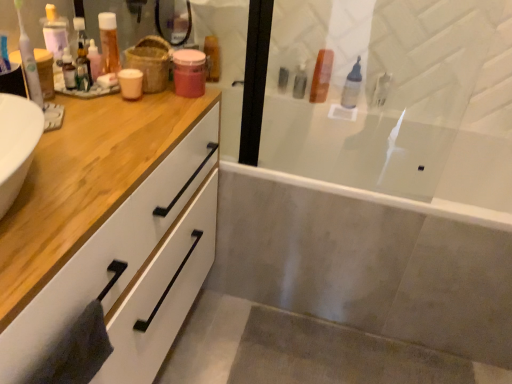
The width and height of the screenshot is (512, 384). What do you see at coordinates (352, 86) in the screenshot?
I see `clear plastic bottle at upper right, the third toiletry positioned from the front` at bounding box center [352, 86].

Identify the location of translucent plastic bottle at upper center, the fourth toiletry viewed from the left. (321, 76).

Describe the element at coordinates (398, 98) in the screenshot. I see `transparent glass screen door at upper center` at that location.

This screenshot has width=512, height=384. What do you see at coordinates (109, 42) in the screenshot? I see `translucent plastic bottle at upper left, acting as the 2th toiletry starting from the left` at bounding box center [109, 42].

Find the location of a particular element. clear plastic bottle at upper right, which is the fifth toiletry in left-to-right order is located at coordinates (352, 86).

Image resolution: width=512 pixels, height=384 pixels. Find the location of `toiletry that is the 3rd object to the left of the transparent glass screen door at upper center, starting at the anchor`. toiletry that is the 3rd object to the left of the transparent glass screen door at upper center, starting at the anchor is located at coordinates (83, 69).

Looking at this image, does transparent glass screen door at upper center have a greater height compared to translucent plastic bottles at upper left, positioned as the fifth toiletry in back-to-front order?

Yes, transparent glass screen door at upper center is taller than translucent plastic bottles at upper left, positioned as the fifth toiletry in back-to-front order.

Is transparent glass screen door at upper center positioned with its back to translucent plastic bottles at upper left, which appears as the first toiletry when viewed from the front?

Yes, translucent plastic bottles at upper left, which appears as the first toiletry when viewed from the front, is at the back of transparent glass screen door at upper center.

Which object is wider, transparent glass screen door at upper center or translucent plastic bottles at upper left, positioned as the fifth toiletry in back-to-front order?

translucent plastic bottles at upper left, positioned as the fifth toiletry in back-to-front order.

From the image's perspective, is translucent plastic bottle at upper center, which is the 2th toiletry in back-to-front order, on top of translucent plastic bottles at upper left, positioned as the fifth toiletry in back-to-front order?

Yes, from the image's perspective, translucent plastic bottle at upper center, which is the 2th toiletry in back-to-front order, is above translucent plastic bottles at upper left, positioned as the fifth toiletry in back-to-front order.

What are the coordinates of `the 3rd toiletry to the left of the translucent plastic bottle at upper center, the 2th toiletry from the right, starting your count from the anchor` in the screenshot? It's located at (83, 69).

Is translucent plastic bottles at upper left, positioned as the fifth toiletry in back-to-front order, inside translucent plastic bottle at upper center, the fourth toiletry viewed from the left?

No, translucent plastic bottles at upper left, positioned as the fifth toiletry in back-to-front order, is located outside of translucent plastic bottle at upper center, the fourth toiletry viewed from the left.

From the image's perspective, would you say translucent plastic bottle at upper left, acting as the 2th toiletry starting from the left, is shown under white plastic toothbrush at left?

No, from the image's perspective, translucent plastic bottle at upper left, acting as the 2th toiletry starting from the left, is not beneath white plastic toothbrush at left.

From the white plastic toothbrush at left, count 2nd toiletry to the right and point to it. Please provide its 2D coordinates.

[(109, 42)]

Which of these two, translucent plastic bottle at upper left, which is counted as the 4th toiletry, starting from the right, or white plastic toothbrush at left, is thinner?

white plastic toothbrush at left is thinner.

From a real-world perspective, is translucent plastic bottle at upper left, which is counted as the 4th toiletry, starting from the right, positioned over white plastic toothbrush at left based on gravity?

No.

Is point (204, 42) farther from camera compared to point (404, 184)?

No.

Locate an element on the screen. toiletry that is the 1st one below the transparent glass screen door at upper center (from a real-world perspective) is located at coordinates (212, 58).

Which of these two, pink matte jar at upper center, which is the first toiletry in back-to-front order, or transparent glass screen door at upper center, is bigger?

transparent glass screen door at upper center.

Considering the sizes of pink matte jar at upper center, placed as the 3th toiletry when sorted from right to left, and transparent glass screen door at upper center in the image, is pink matte jar at upper center, placed as the 3th toiletry when sorted from right to left, wider or thinner than transparent glass screen door at upper center?

pink matte jar at upper center, placed as the 3th toiletry when sorted from right to left, is wider than transparent glass screen door at upper center.

How many degrees apart are the facing directions of pink matte jar at upper center, which is the first toiletry in back-to-front order, and burlap basket at upper center?

There is a 85.5-degree angle between the facing directions of pink matte jar at upper center, which is the first toiletry in back-to-front order, and burlap basket at upper center.

From a real-world perspective, is pink matte jar at upper center, which is the first toiletry in back-to-front order, physically located above or below burlap basket at upper center?

pink matte jar at upper center, which is the first toiletry in back-to-front order, is below burlap basket at upper center.

In terms of size, does pink matte jar at upper center, the third toiletry from the left, appear bigger or smaller than burlap basket at upper center?

Clearly, pink matte jar at upper center, the third toiletry from the left, is smaller in size than burlap basket at upper center.

Between point (219, 65) and point (146, 50), which one is positioned behind?

The point (219, 65) is more distant.

Do you think translucent plastic bottle at upper center, the fourth toiletry viewed from the left, is within transparent glass screen door at upper center, or outside of it?

translucent plastic bottle at upper center, the fourth toiletry viewed from the left, is not enclosed by transparent glass screen door at upper center.

I want to click on screen door located above the translucent plastic bottle at upper center, the 2th toiletry from the right (from a real-world perspective), so click(x=398, y=98).

Between translucent plastic bottle at upper center, marked as the fourth toiletry in a front-to-back arrangement, and transparent glass screen door at upper center, which one has more height?

Standing taller between the two is transparent glass screen door at upper center.

Which is in front, translucent plastic bottle at upper center, marked as the fourth toiletry in a front-to-back arrangement, or transparent glass screen door at upper center?

Positioned in front is transparent glass screen door at upper center.

Is transparent glass screen door at upper center facing towards translucent plastic bottle at upper left, which is counted as the 4th toiletry, starting from the right?

Yes, transparent glass screen door at upper center is turned towards translucent plastic bottle at upper left, which is counted as the 4th toiletry, starting from the right.

Is transparent glass screen door at upper center beside translucent plastic bottle at upper left, which is the second toiletry from front to back?

transparent glass screen door at upper center and translucent plastic bottle at upper left, which is the second toiletry from front to back, are not in contact.

Does transparent glass screen door at upper center have a smaller size compared to translucent plastic bottle at upper left, which is the second toiletry from front to back?

Incorrect, transparent glass screen door at upper center is not smaller in size than translucent plastic bottle at upper left, which is the second toiletry from front to back.

Looking at this image, can you confirm if transparent glass screen door at upper center is shorter than translucent plastic bottle at upper left, acting as the 2th toiletry starting from the left?

In fact, transparent glass screen door at upper center may be taller than translucent plastic bottle at upper left, acting as the 2th toiletry starting from the left.

The width and height of the screenshot is (512, 384). Find the location of `toiletry that is the 1st object located behind the transparent glass screen door at upper center`. toiletry that is the 1st object located behind the transparent glass screen door at upper center is located at coordinates (83, 69).

Locate an element on the screen. This screenshot has width=512, height=384. the 3rd toiletry in front of the translucent plastic bottle at upper center, the 2th toiletry from the right, starting your count from the anchor is located at coordinates click(83, 69).

Considering their positions, is translucent plastic bottles at upper left, which appears as the 5th toiletry when viewed from the right, positioned closer to white plastic toothbrush at left than pink matte jar at upper center, placed as the 5th toiletry when sorted from front to back?

translucent plastic bottles at upper left, which appears as the 5th toiletry when viewed from the right.

Considering their positions, is transparent glass screen door at upper center positioned closer to white glossy bathtub at center than translucent plastic bottle at upper center, the fourth toiletry viewed from the left?

transparent glass screen door at upper center.

Based on their spatial positions, is clear plastic bottle at upper right, the third toiletry positioned from the front, or pink matte jar at upper center, placed as the 3th toiletry when sorted from right to left, closer to white plastic toothbrush at left?

pink matte jar at upper center, placed as the 3th toiletry when sorted from right to left, is closer to white plastic toothbrush at left.

Which object lies nearer to the anchor point burlap basket at upper center, pink matte jar at upper center, the third toiletry from the left, or translucent plastic bottle at upper left, acting as the 2th toiletry starting from the left?

Among the two, translucent plastic bottle at upper left, acting as the 2th toiletry starting from the left, is located nearer to burlap basket at upper center.

Looking at the image, which one is located closer to translucent plastic bottle at upper center, the 2th toiletry from the right, pink matte jar at upper center, which is the first toiletry in back-to-front order, or transparent glass screen door at upper center?

transparent glass screen door at upper center is closer to translucent plastic bottle at upper center, the 2th toiletry from the right.

Looking at the image, which one is located further to translucent plastic bottle at upper left, which is counted as the 4th toiletry, starting from the right, transparent glass screen door at upper center or translucent plastic bottle at upper center, marked as the fourth toiletry in a front-to-back arrangement?

Based on the image, transparent glass screen door at upper center appears to be further to translucent plastic bottle at upper left, which is counted as the 4th toiletry, starting from the right.

Based on their spatial positions, is translucent plastic bottle at upper center, the 2th toiletry from the right, or white glossy bathtub at center closer to clear plastic bottle at upper right, the third toiletry positioned from the front?

The object closer to clear plastic bottle at upper right, the third toiletry positioned from the front, is translucent plastic bottle at upper center, the 2th toiletry from the right.

Looking at the image, which one is located further to translucent plastic bottles at upper left, which appears as the 5th toiletry when viewed from the right, translucent plastic bottle at upper center, the fourth toiletry viewed from the left, or translucent plastic bottle at upper left, acting as the 2th toiletry starting from the left?

translucent plastic bottle at upper center, the fourth toiletry viewed from the left, is further to translucent plastic bottles at upper left, which appears as the 5th toiletry when viewed from the right.

Where is `bath between transparent glass screen door at upper center and clear plastic bottle at upper right, which is the fifth toiletry in left-to-right order, in the front-back direction`? This screenshot has width=512, height=384. bath between transparent glass screen door at upper center and clear plastic bottle at upper right, which is the fifth toiletry in left-to-right order, in the front-back direction is located at coordinates (365, 264).

Locate an element on the screen. basket between transparent glass screen door at upper center and translucent plastic bottle at upper center, the 2th toiletry from the right, along the z-axis is located at coordinates (150, 62).

Find the location of a particular element. The image size is (512, 384). basket situated between white plastic toothbrush at left and transparent glass screen door at upper center from left to right is located at coordinates (150, 62).

What are the coordinates of `basket between transparent glass screen door at upper center and clear plastic bottle at upper right, which is the fifth toiletry in left-to-right order, along the z-axis` in the screenshot? It's located at (150, 62).